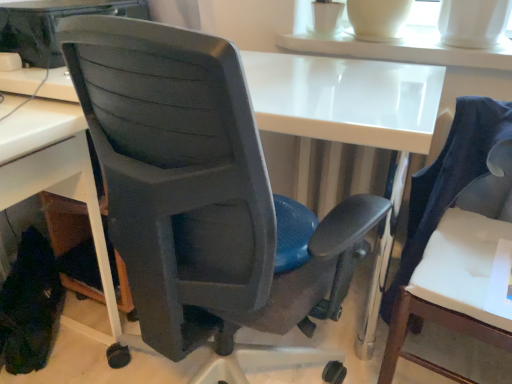
Question: Considering their positions, is white plastic desk at lower left located in front of or behind white fabric chair at right, the 1th chair viewed from the right?

Choices:
 (A) front
 (B) behind

Answer: (B)

Question: Considering the positions of point (28, 183) and point (481, 144), is point (28, 183) closer or farther from the camera than point (481, 144)?

Choices:
 (A) closer
 (B) farther

Answer: (A)

Question: Which of these objects is positioned closest to the matte plastic chair at center, marked as the second chair in a right-to-left arrangement?

Choices:
 (A) white plastic desk at lower left
 (B) white fabric chair at right, the 1th chair viewed from the right
 (C) white glossy table at upper center

Answer: (A)

Question: Based on their relative distances, which object is nearer to the white fabric chair at right, arranged as the 2th chair when viewed from the left?

Choices:
 (A) white plastic desk at lower left
 (B) white glossy table at upper center
 (C) matte plastic chair at center, the first chair from the left

Answer: (B)